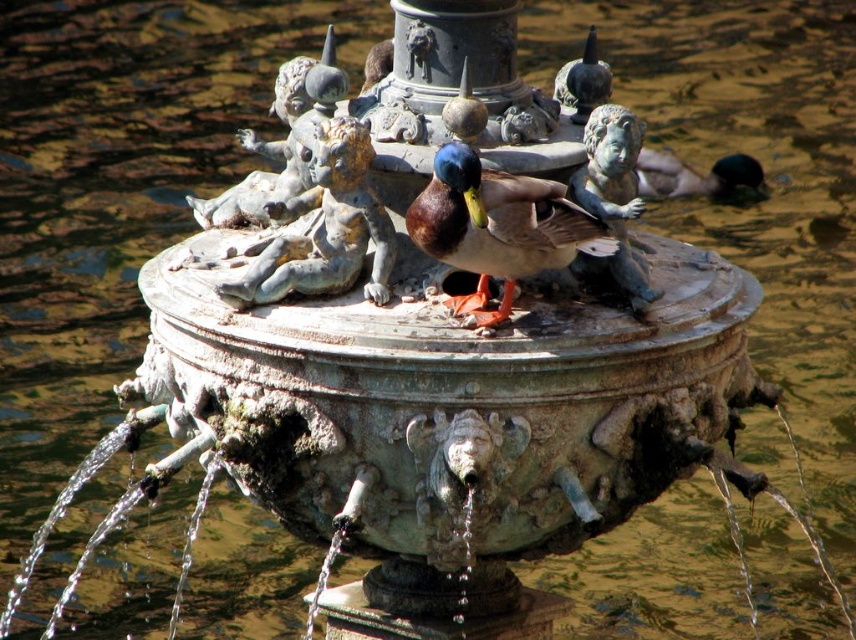
In the scene shown: Who is more forward, (584, 228) or (679, 182)?

Positioned in front is point (584, 228).

Find the location of a particular element. The width and height of the screenshot is (856, 640). shiny brown duck at center is located at coordinates (498, 227).

Between shiny brown duck at center and bronze cherub at center, which one appears on the left side from the viewer's perspective?

From the viewer's perspective, bronze cherub at center appears more on the left side.

Is shiny brown duck at center behind bronze cherub at center?

That is False.

Who is more forward, (429, 252) or (299, 282)?

Point (429, 252) is in front.

You are a GUI agent. You are given a task and a screenshot of the screen. Output one action in this format:
    pyautogui.click(x=<x>, y=<y>)
    Task: Click on the shiny brown duck at center
    The height and width of the screenshot is (640, 856).
    Given the screenshot: What is the action you would take?
    pyautogui.click(x=498, y=227)

Does blue-green stone cherub at center appear over shiny green duck at right?

Incorrect, blue-green stone cherub at center is not positioned above shiny green duck at right.

In order to click on blue-green stone cherub at center in this screenshot , I will do pyautogui.click(x=613, y=196).

Who is more forward, (614, 230) or (649, 154)?

Point (614, 230) is more forward.

This screenshot has width=856, height=640. What are the coordinates of `blue-green stone cherub at center` in the screenshot? It's located at (613, 196).